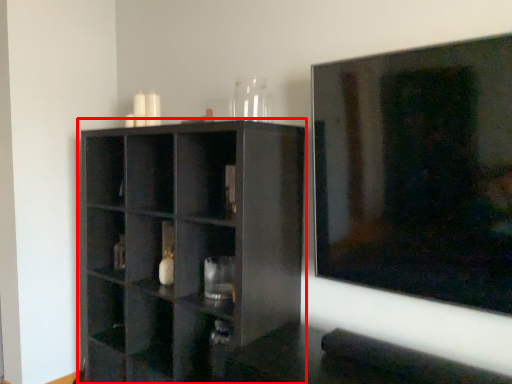
Question: From the image's perspective, considering the relative positions of shelf (annotated by the red box) and glass vase in the image provided, where is shelf (annotated by the red box) located with respect to the staircase?

Choices:
 (A) above
 (B) below

Answer: (B)